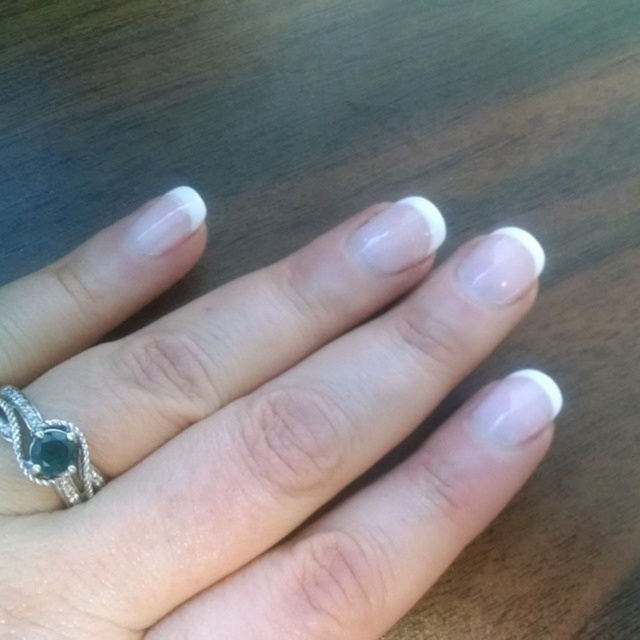
Looking at the hand in the image, which object has a greater height between the white glossy nails at center and the polished silver ring with green gemstone at center?

The white glossy nails at center has a greater height compared to the polished silver ring with green gemstone at center according to the description.

You are a jeweler examining the hand in the image. You need to place a new ring on the finger. The new ring must be placed to the left of the existing polished silver ring with green gemstone at center. Where should you position the new ring relative to the white glossy nails at center?

The white glossy nails at center are to the right of the polished silver ring with green gemstone at center. Therefore, to place the new ring to the left of the existing ring, it should be positioned to the left of the polished silver ring with green gemstone at center, which is to the left of the white glossy nails at center.

Consider the image. You are a jeweler examining the hand in the image. You need to clean the white glossy nails at center and the polished silver ring with green gemstone at center. Which object should you clean first if you start from the closest to you?

The white glossy nails at center should be cleaned first because they are closer to the viewer than the polished silver ring with green gemstone at center.